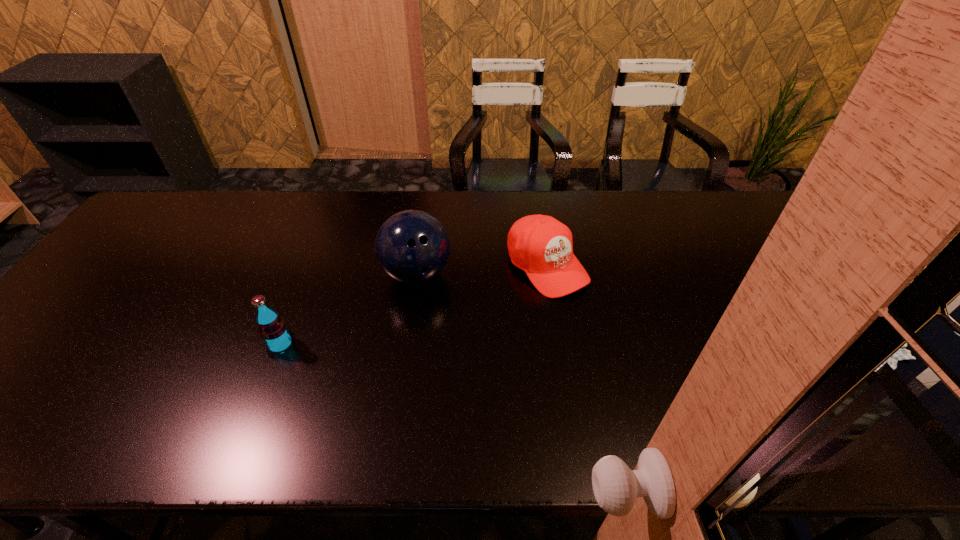
Locate an element on the screen. empty location between the tallest object and the rightmost object is located at coordinates (482, 270).

You are a GUI agent. You are given a task and a screenshot of the screen. Output one action in this format:
    pyautogui.click(x=<x>, y=<y>)
    Task: Click on the free space that is in between the second tallest object and the bowling ball
    
    Given the screenshot: What is the action you would take?
    pyautogui.click(x=348, y=309)

At what (x,y) coordinates should I click in order to perform the action: click on the second closest object to the second object from left to right. Please return your answer as a coordinate pair (x, y). Looking at the image, I should click on (272, 328).

Locate an element on the screen. This screenshot has height=540, width=960. object that is the second closest one to the tallest object is located at coordinates (272, 328).

Identify the location of free region that satisfies the following two spatial constraints: 1. on the back side of the nearest object; 2. on the left side of the rightmost object. (311, 266).